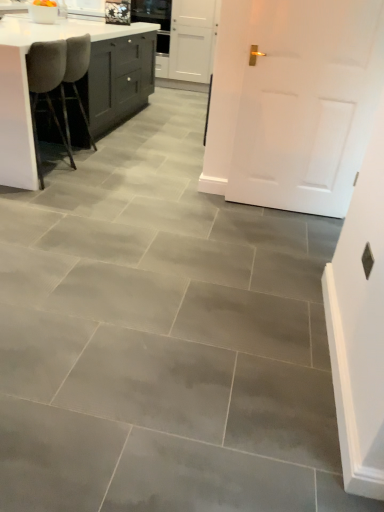
Question: Choose the correct answer: Is white matte door at center inside gray fabric chair at left, arranged as the 1th chair when viewed from the back, or outside it?

Choices:
 (A) outside
 (B) inside

Answer: (A)

Question: In the image, is white matte door at center positioned in front of or behind gray fabric chair at left, arranged as the 1th chair when viewed from the back?

Choices:
 (A) behind
 (B) front

Answer: (B)

Question: Which object is the closest to the white matte door at center?

Choices:
 (A) white glossy countertop at upper left
 (B) velvet grey chair at left, the second chair from the back
 (C) gray fabric chair at left, positioned as the second chair in front-to-back order

Answer: (B)

Question: Which of these objects is positioned closest to the white glossy countertop at upper left?

Choices:
 (A) velvet grey chair at left, the second chair from the back
 (B) gray fabric chair at left, positioned as the second chair in front-to-back order
 (C) white matte door at center

Answer: (A)